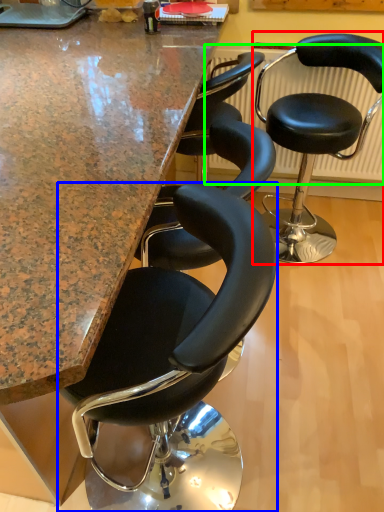
Question: Which is nearer to the chair (highlighted by a red box)? chair (highlighted by a blue box) or radiator (highlighted by a green box).

Choices:
 (A) chair
 (B) radiator

Answer: (B)